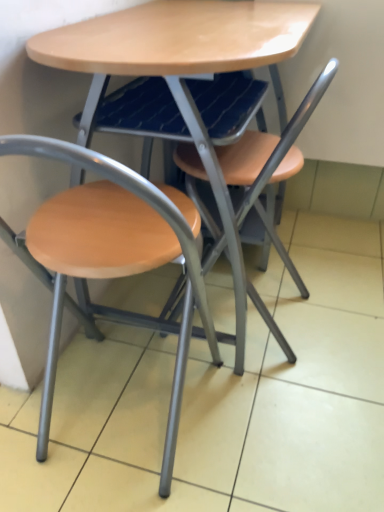
Question: Looking at their shapes, would you say matte wood chair at left, marked as the first chair in a left-to-right arrangement, is wider or thinner than matte wood table at center?

Choices:
 (A) thin
 (B) wide

Answer: (A)

Question: Choose the correct answer: Is matte wood chair at left, marked as the first chair in a left-to-right arrangement, inside matte wood table at center or outside it?

Choices:
 (A) outside
 (B) inside

Answer: (B)

Question: Estimate the real-world distances between objects in this image. Which object is farther from the matte wood table at center?

Choices:
 (A) wooden seat at center, acting as the second chair starting from the left
 (B) matte wood chair at left, which is counted as the second chair, starting from the right

Answer: (B)

Question: Estimate the real-world distances between objects in this image. Which object is closer to the matte wood chair at left, which is counted as the second chair, starting from the right?

Choices:
 (A) matte wood table at center
 (B) wooden seat at center, positioned as the first chair in right-to-left order

Answer: (B)